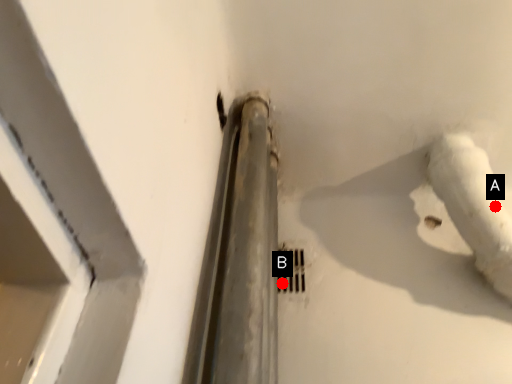
Question: Two points are circled on the image, labeled by A and B beside each circle. Which point is farther to the camera?

Choices:
 (A) A is further
 (B) B is further

Answer: (B)